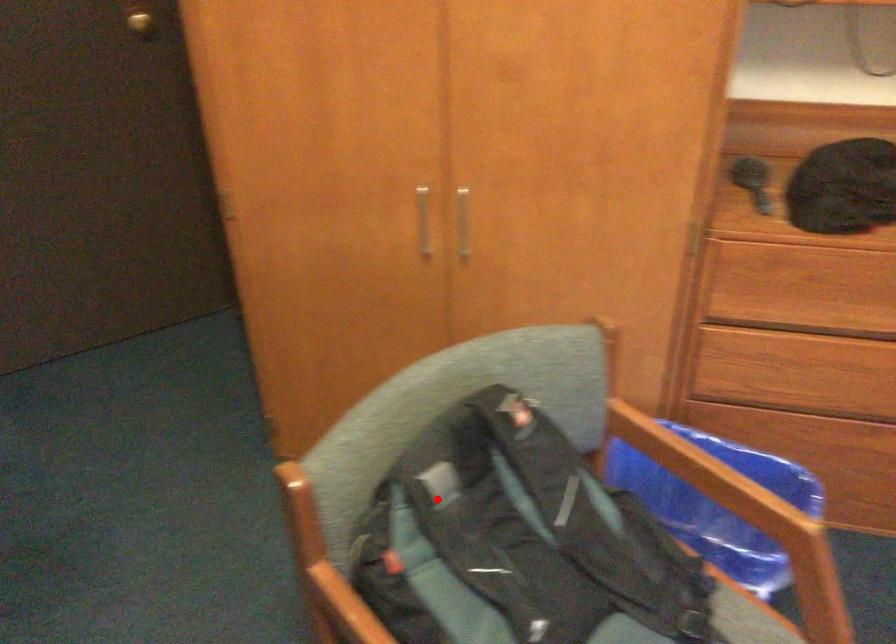
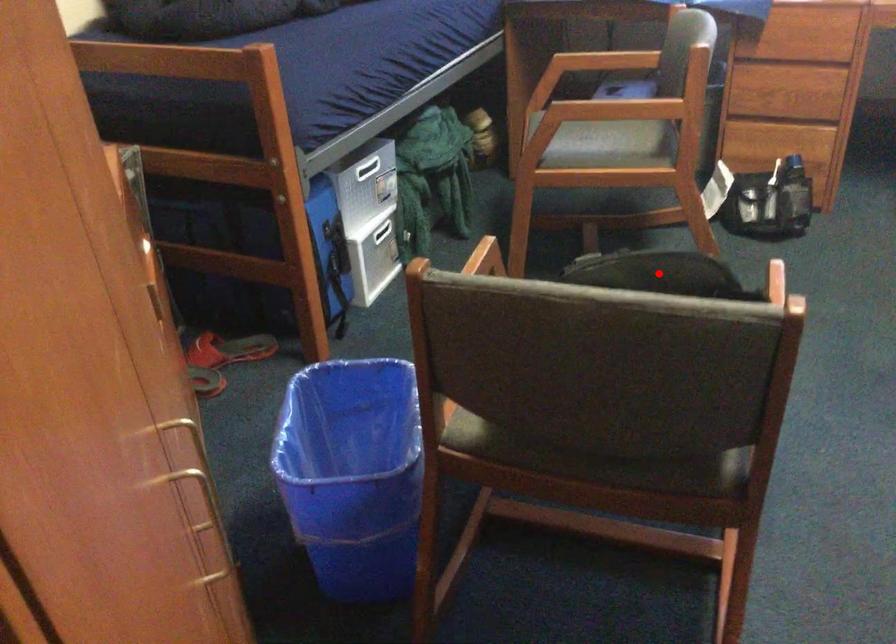
I am providing you with two images of the same scene from different viewpoints. A red point is marked on the first image and another point is marked on the second image. Does the point marked in image1 correspond to the same location as the one in image2?

Yes